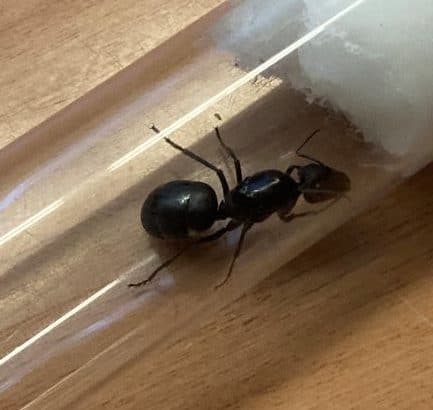
Find the location of a particular element. right front leg is located at coordinates (284, 215).